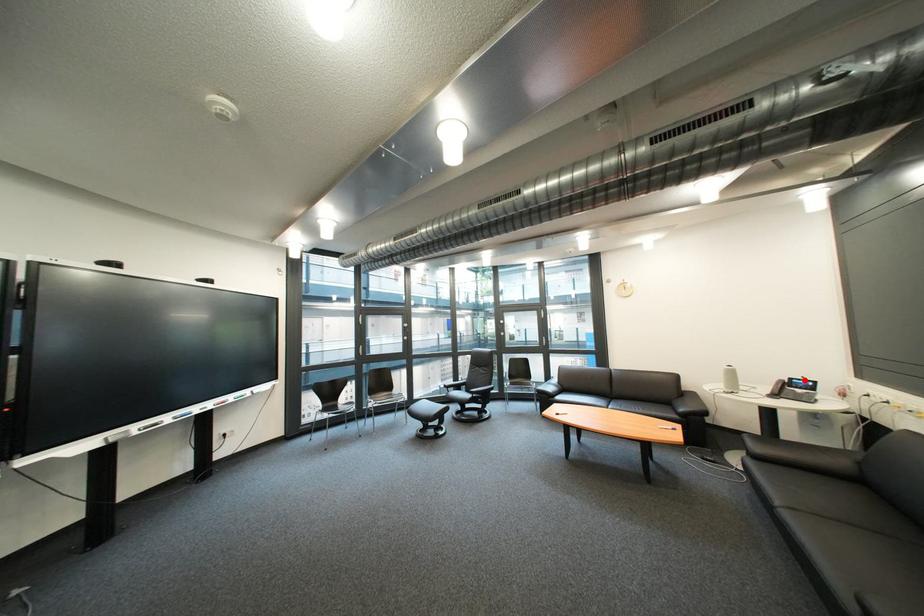
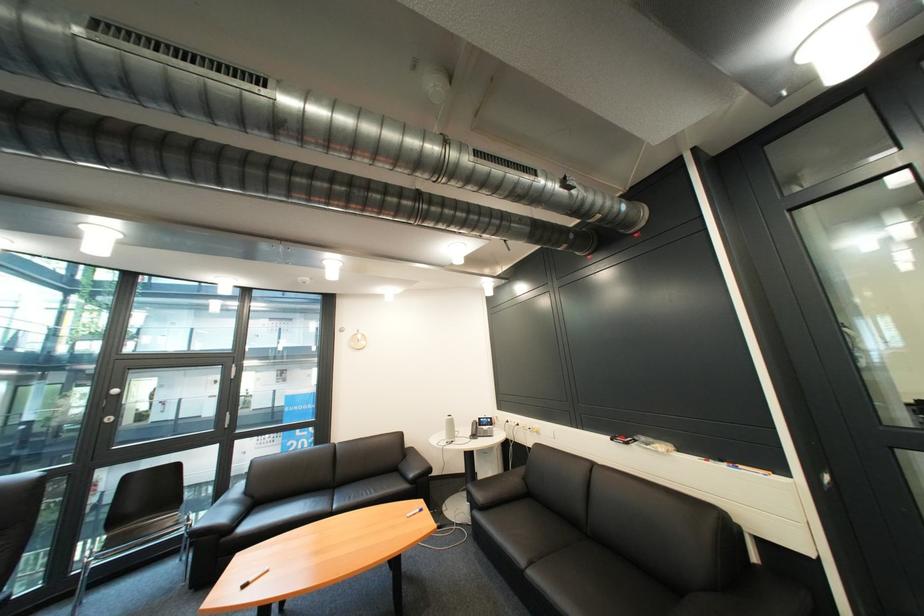
Where in the second image is the point corresponding to the highlighted location from the first image?

(492, 419)